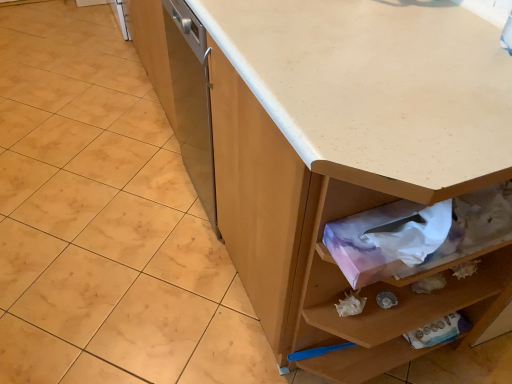
Question: Is white laminate countertop at center looking in the opposite direction of pink paper tissue at lower right?

Choices:
 (A) no
 (B) yes

Answer: (A)

Question: Considering the relative sizes of white laminate countertop at center and pink paper tissue at lower right in the image provided, is white laminate countertop at center thinner than pink paper tissue at lower right?

Choices:
 (A) no
 (B) yes

Answer: (A)

Question: Is the depth of white laminate countertop at center less than that of pink paper tissue at lower right?

Choices:
 (A) no
 (B) yes

Answer: (B)

Question: From the image's perspective, is white laminate countertop at center beneath pink paper tissue at lower right?

Choices:
 (A) yes
 (B) no

Answer: (B)

Question: Can you confirm if white laminate countertop at center is bigger than pink paper tissue at lower right?

Choices:
 (A) no
 (B) yes

Answer: (B)

Question: In terms of height, does pink paper tissue at lower right look taller or shorter compared to white laminate countertop at center?

Choices:
 (A) tall
 (B) short

Answer: (B)

Question: Is pink paper tissue at lower right to the left or to the right of white laminate countertop at center in the image?

Choices:
 (A) left
 (B) right

Answer: (B)

Question: Relative to white laminate countertop at center, is pink paper tissue at lower right in front or behind?

Choices:
 (A) behind
 (B) front

Answer: (A)

Question: From the image's perspective, relative to white laminate countertop at center, is pink paper tissue at lower right above or below?

Choices:
 (A) above
 (B) below

Answer: (B)

Question: Is pink paper tissue at lower right taller or shorter than white matte granite at center?

Choices:
 (A) tall
 (B) short

Answer: (A)

Question: From the image's perspective, relative to white matte granite at center, is pink paper tissue at lower right above or below?

Choices:
 (A) below
 (B) above

Answer: (A)

Question: Considering the positions of pink paper tissue at lower right and white matte granite at center in the image, is pink paper tissue at lower right bigger or smaller than white matte granite at center?

Choices:
 (A) big
 (B) small

Answer: (B)

Question: Considering their positions, is pink paper tissue at lower right located in front of or behind white matte granite at center?

Choices:
 (A) front
 (B) behind

Answer: (A)

Question: From a real-world perspective, is white laminate countertop at center positioned above or below white matte granite at center?

Choices:
 (A) below
 (B) above

Answer: (B)

Question: Is point (399, 122) closer or farther from the camera than point (197, 311)?

Choices:
 (A) farther
 (B) closer

Answer: (B)